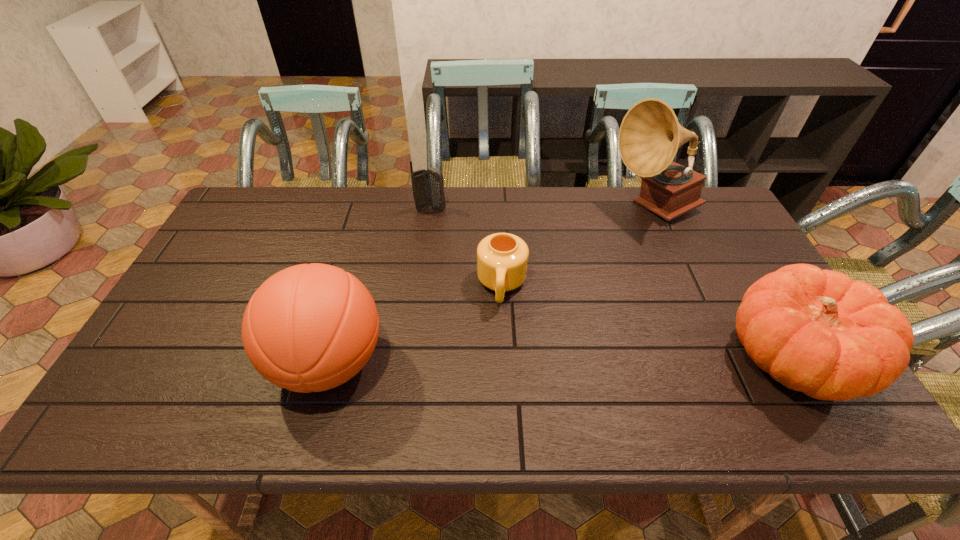
Where is `the fourth shortest object`? the fourth shortest object is located at coordinates coord(308,328).

Find the location of a particular element. The width and height of the screenshot is (960, 540). the leftmost object is located at coordinates (308, 328).

Find the location of a particular element. Image resolution: width=960 pixels, height=540 pixels. pumpkin is located at coordinates (816, 331).

The width and height of the screenshot is (960, 540). In order to click on the third object from right to left in this screenshot , I will do `click(502, 258)`.

Find the location of a particular element. The image size is (960, 540). mug is located at coordinates (502, 258).

You are a GUI agent. You are given a task and a screenshot of the screen. Output one action in this format:
    pyautogui.click(x=<x>, y=<y>)
    Task: Click on the cellular telephone
    
    Given the screenshot: What is the action you would take?
    pyautogui.click(x=427, y=185)

I want to click on phonograph record, so click(650, 135).

Where is `free space located 0.240m on the back of the fourth shortest object`? free space located 0.240m on the back of the fourth shortest object is located at coordinates (359, 255).

Where is `vacant space positioned 0.190m on the back of the pumpkin`? The width and height of the screenshot is (960, 540). vacant space positioned 0.190m on the back of the pumpkin is located at coordinates (734, 260).

Locate an element on the screen. The height and width of the screenshot is (540, 960). free space located on the handle side of the mug is located at coordinates (498, 342).